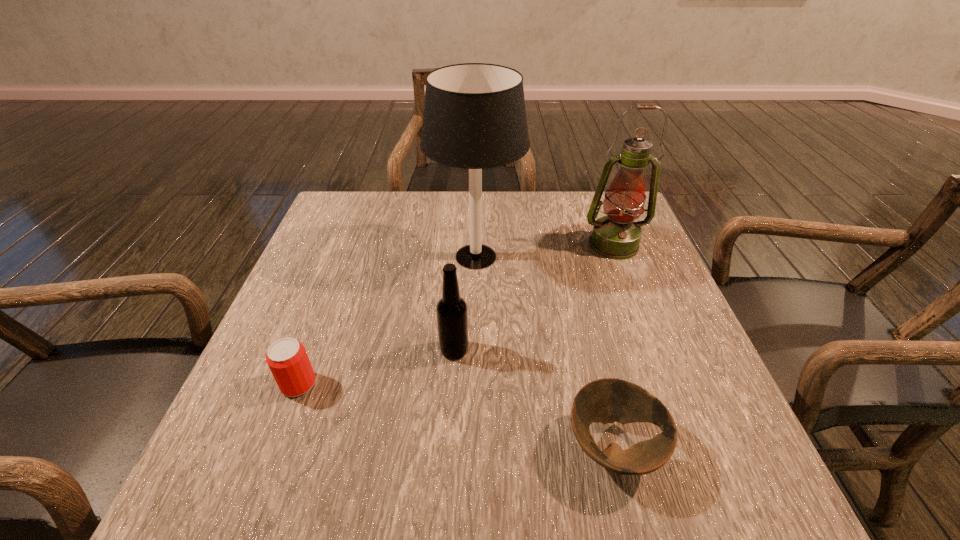
This screenshot has height=540, width=960. In order to click on vacant position located on the front of the third tallest object in this screenshot , I will do `click(451, 397)`.

Locate an element on the screen. blank area located 0.200m on the right of the second nearest object is located at coordinates pos(422,384).

Locate an element on the screen. The width and height of the screenshot is (960, 540). vacant space located 0.080m on the left of the bowl is located at coordinates (516, 448).

Locate an element on the screen. Image resolution: width=960 pixels, height=540 pixels. table lamp that is at the far edge is located at coordinates (474, 118).

The height and width of the screenshot is (540, 960). I want to click on oil lamp present at the far edge, so click(616, 236).

Locate an element on the screen. This screenshot has height=540, width=960. object present at the near edge is located at coordinates (608, 400).

Where is `object that is at the left edge`? object that is at the left edge is located at coordinates (287, 358).

Identify the location of oil lamp located at the right edge. (616, 236).

Find the location of `bowl at the right edge`. bowl at the right edge is located at coordinates (608, 400).

Locate an element on the screen. The image size is (960, 540). object that is at the far right corner is located at coordinates (616, 236).